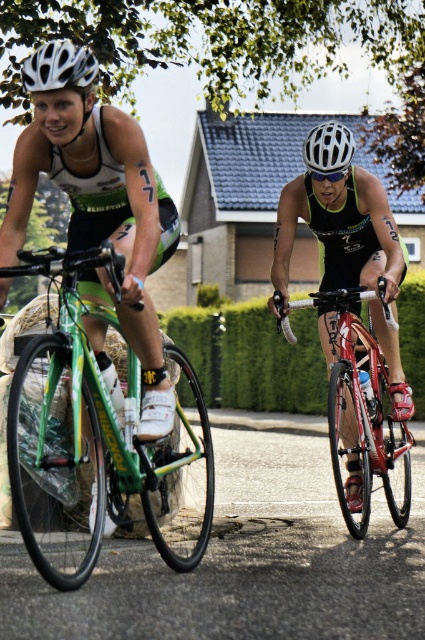
Question: Which point is farther to the camera?

Choices:
 (A) (340, 170)
 (B) (379, 285)

Answer: (A)

Question: Which object appears closest to the camera in this image?

Choices:
 (A) shiny red bicycle at center
 (B) white matte bicycle helmet at center

Answer: (A)

Question: Does white matte helmet at upper left have a smaller size compared to white matte goggles at center?

Choices:
 (A) no
 (B) yes

Answer: (A)

Question: Is white matte helmet at upper left behind white matte bicycle helmet at upper left?

Choices:
 (A) no
 (B) yes

Answer: (A)

Question: Does green matte bicycle at left appear under shiny red bicycle at center?

Choices:
 (A) yes
 (B) no

Answer: (B)

Question: Which of these objects is positioned closest to the white matte goggles at center?

Choices:
 (A) shiny red bicycle at center
 (B) green matte bicycle at left

Answer: (A)